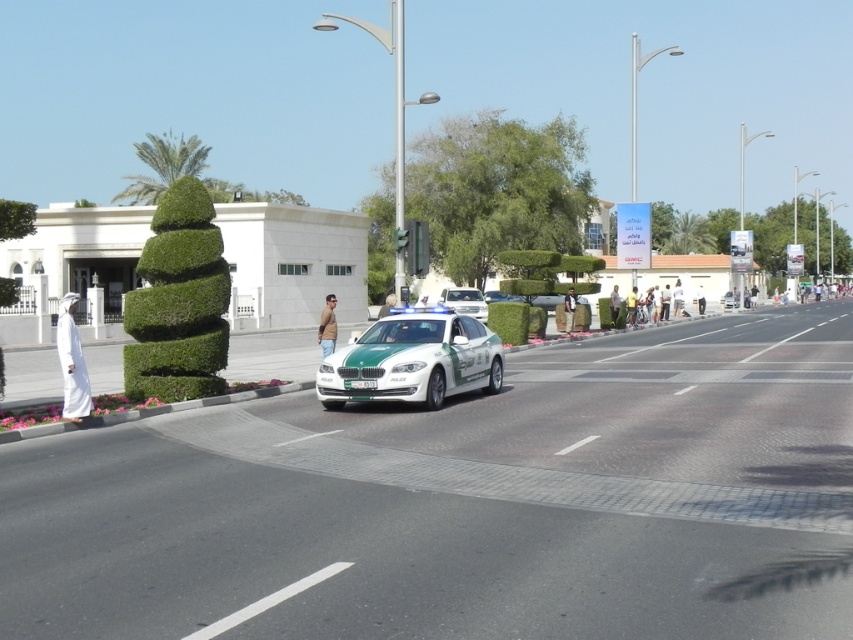
Question: Is green matte police car at center bigger than white glossy sedan at center?

Choices:
 (A) yes
 (B) no

Answer: (B)

Question: Does green matte police car at center have a lesser width compared to white glossy sedan at center?

Choices:
 (A) yes
 (B) no

Answer: (B)

Question: Is green matte police car at center positioned before white glossy sedan at center?

Choices:
 (A) no
 (B) yes

Answer: (B)

Question: Which of the following is the closest to the observer?

Choices:
 (A) white glossy sedan at center
 (B) green matte police car at center

Answer: (B)